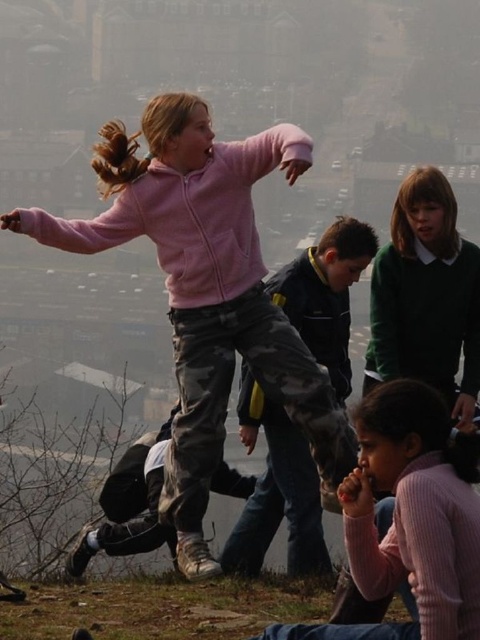
You are a photographer trying to capture a photo of the two children wearing pink clothing. The matte pink hoodie at upper left and the pink ribbed sweater at lower right are both in your viewfinder. Based on their positions, which child is positioned higher in the frame?

The matte pink hoodie at upper left is positioned higher in the frame than the pink ribbed sweater at lower right.